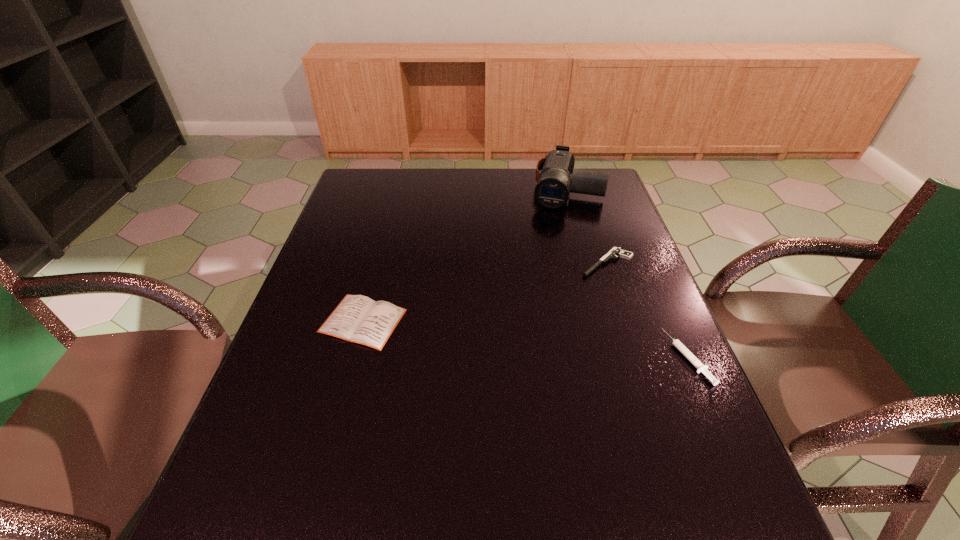
The width and height of the screenshot is (960, 540). I want to click on free location located on the lens of the tallest object, so click(555, 234).

Locate an element on the screen. This screenshot has height=540, width=960. vacant space located 0.300m on the front-facing side of the pistol is located at coordinates (520, 336).

Locate an element on the screen. The width and height of the screenshot is (960, 540). vacant area situated on the front-facing side of the pistol is located at coordinates (546, 313).

In order to click on free space located on the front-facing side of the pistol in this screenshot , I will do `click(540, 318)`.

Locate an element on the screen. object situated at the far edge is located at coordinates (552, 191).

Find the location of a particular element. This screenshot has width=960, height=540. object present at the left edge is located at coordinates (x=359, y=319).

Find the location of a particular element. syringe present at the right edge is located at coordinates (701, 368).

Find the location of a particular element. camcorder situated at the right edge is located at coordinates coord(552,191).

What are the coordinates of `pistol that is at the right edge` in the screenshot? It's located at (616, 251).

At what (x,y) coordinates should I click in order to perform the action: click on object located at the far right corner. Please return your answer as a coordinate pair (x, y). Looking at the image, I should click on (552, 191).